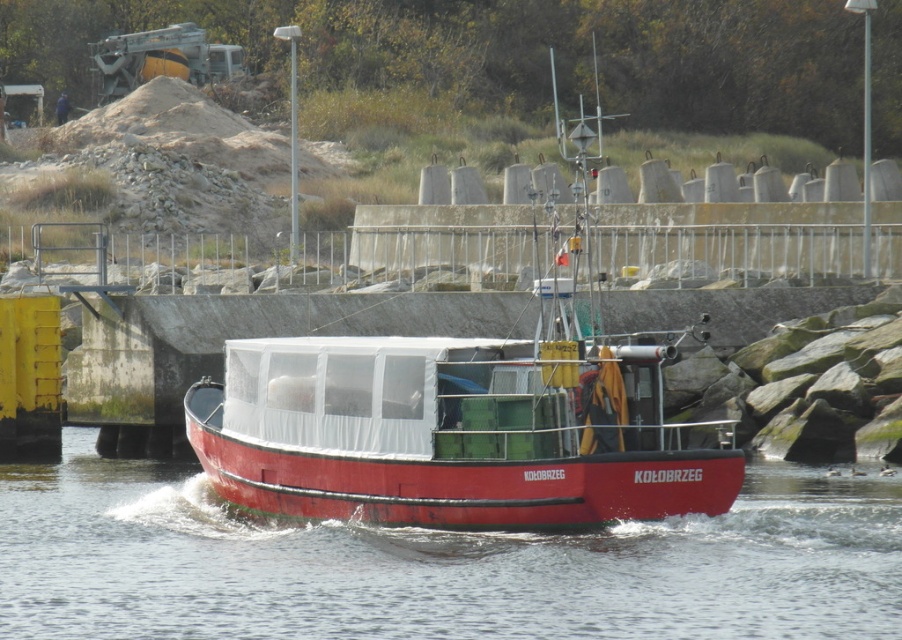
Question: Is transparent plastic water at center positioned in front of red matte boat at center?

Choices:
 (A) no
 (B) yes

Answer: (B)

Question: Which point is farther from the camera taking this photo?

Choices:
 (A) (655, 355)
 (B) (421, 557)

Answer: (A)

Question: Which point appears farthest from the camera in this image?

Choices:
 (A) (665, 464)
 (B) (267, 620)

Answer: (A)

Question: Is transparent plastic water at center to the right of red matte boat at center from the viewer's perspective?

Choices:
 (A) no
 (B) yes

Answer: (A)

Question: Can you confirm if transparent plastic water at center is positioned to the left of red matte boat at center?

Choices:
 (A) no
 (B) yes

Answer: (B)